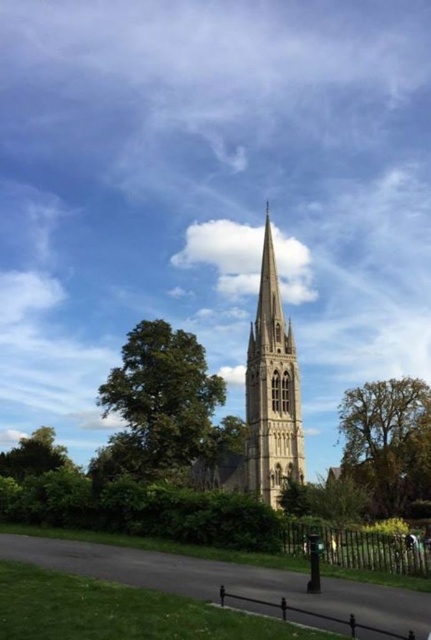
What is the spatial relationship between the green leafy tree at center and the green leafy tree at right in the scene?

The green leafy tree at center is positioned in front of the green leafy tree at right, meaning the one at the center is closer to the viewer while the one at the right is farther back.

You are a visitor standing on the paved pathway bordered by the black metal fence. You want to take a photo of both the green leafy tree at center and the green leafy tree at right in the same frame. Which tree should you move closer to in order to include both trees in your photo?

To include both the green leafy tree at center and the green leafy tree at right in the same frame, you should move closer to the green leafy tree at right since it is smaller and requires a wider angle or a step back, but since the question asks which to move closer to, perhaps the bigger tree is closer, so moving towards it might include both. Wait, need to think carefully. The trees are at center and right. The center tree is bigger. To capture both in the same frame, if you are on the path, maybe moving